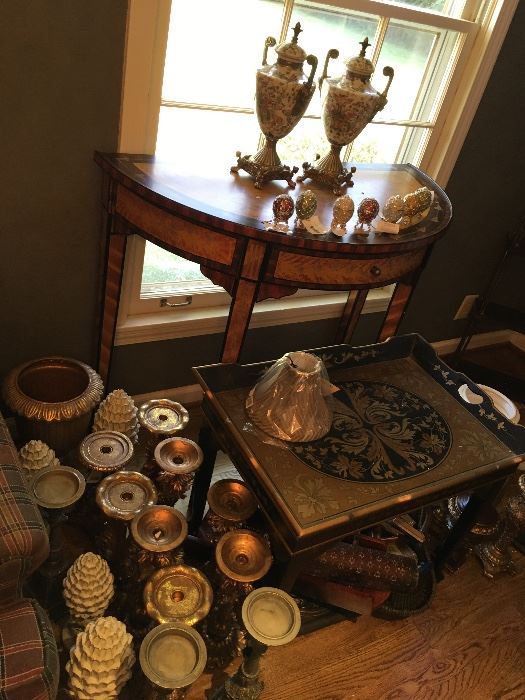
Identify the location of antiques. This screenshot has width=525, height=700. (164, 533).